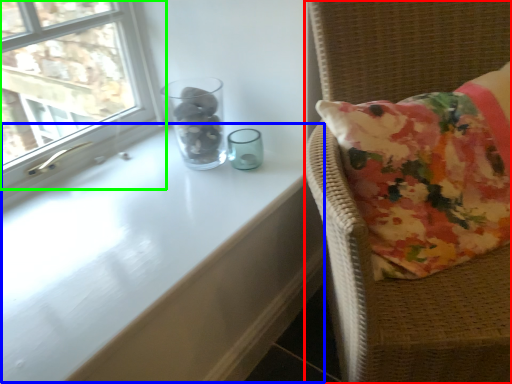
Question: Which object is the closest to the furniture (highlighted by a red box)? Choose among these: table (highlighted by a blue box) or window (highlighted by a green box).

Choices:
 (A) table
 (B) window

Answer: (A)